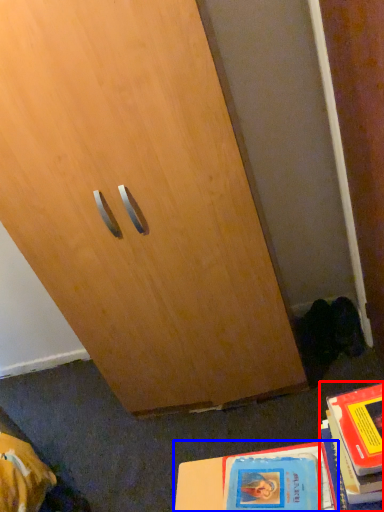
Question: Which object is further to the camera taking this photo, book (highlighted by a red box) or book (highlighted by a blue box)?

Choices:
 (A) book
 (B) book

Answer: (B)